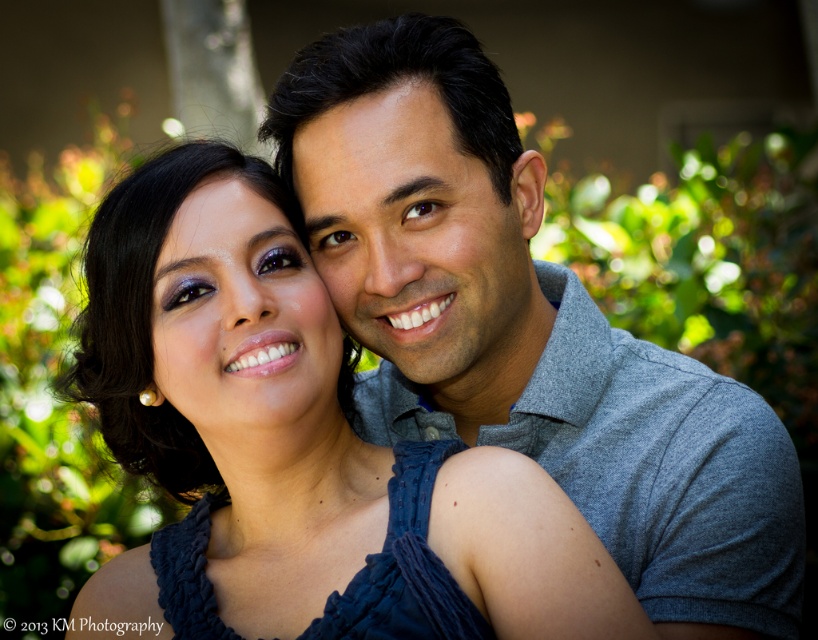
You are standing in front of a photo of a couple. The woman is wearing a dark blue top, and the man is wearing a gray cotton shirt at upper right. If you want to see the man more clearly, should you move closer to or farther away from the photo?

To see the man more clearly, you should move closer to the photo. The gray cotton shirt at upper right is 3.87 feet away from the viewer, so reducing this distance would enhance clarity.

You are a photographer adjusting your camera focus. You want to ensure both the gray cotton shirt at upper right and the smooth skin face at center are in focus. Which object should you focus on first to achieve this?

You should focus on the gray cotton shirt at upper right first because it is closer to the viewer than the smooth skin face at center. By focusing on the closer object, the depth of field may extend to include the farther object in acceptable focus.